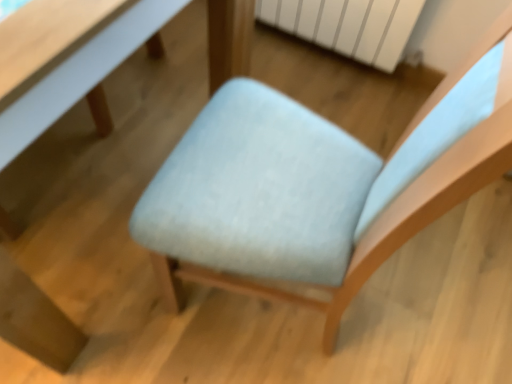
Question: From the image's perspective, is white matte radiator at upper center under light blue fabric chair at center?

Choices:
 (A) no
 (B) yes

Answer: (A)

Question: Considering the relative sizes of white matte radiator at upper center and light blue fabric chair at center in the image provided, is white matte radiator at upper center taller than light blue fabric chair at center?

Choices:
 (A) yes
 (B) no

Answer: (B)

Question: Considering the relative sizes of white matte radiator at upper center and light blue fabric chair at center in the image provided, is white matte radiator at upper center wider than light blue fabric chair at center?

Choices:
 (A) no
 (B) yes

Answer: (A)

Question: Is white matte radiator at upper center placed right next to light blue fabric chair at center?

Choices:
 (A) yes
 (B) no

Answer: (B)

Question: From a real-world perspective, does white matte radiator at upper center stand above light blue fabric chair at center?

Choices:
 (A) no
 (B) yes

Answer: (A)

Question: Considering the positions of white matte radiator at upper center and light blue fabric chair at center in the image, is white matte radiator at upper center bigger or smaller than light blue fabric chair at center?

Choices:
 (A) big
 (B) small

Answer: (B)

Question: From a real-world perspective, relative to light blue fabric chair at center, is white matte radiator at upper center vertically above or below?

Choices:
 (A) below
 (B) above

Answer: (A)

Question: Would you say white matte radiator at upper center is inside or outside light blue fabric chair at center?

Choices:
 (A) outside
 (B) inside

Answer: (A)

Question: In terms of width, does white matte radiator at upper center look wider or thinner when compared to light blue fabric chair at center?

Choices:
 (A) thin
 (B) wide

Answer: (A)

Question: In terms of width, does white glossy table at upper left, acting as the 2th table starting from the left, look wider or thinner when compared to light blue fabric chair at center?

Choices:
 (A) thin
 (B) wide

Answer: (A)

Question: Looking at the image, does white glossy table at upper left, the first table in the right-to-left sequence, seem bigger or smaller compared to light blue fabric chair at center?

Choices:
 (A) small
 (B) big

Answer: (A)

Question: From a real-world perspective, is white glossy table at upper left, acting as the 2th table starting from the left, positioned above or below light blue fabric chair at center?

Choices:
 (A) above
 (B) below

Answer: (B)

Question: Considering the relative positions of white glossy table at upper left, the first table in the right-to-left sequence, and light blue fabric chair at center in the image provided, is white glossy table at upper left, the first table in the right-to-left sequence, to the left or to the right of light blue fabric chair at center?

Choices:
 (A) right
 (B) left

Answer: (B)

Question: In the image, is white matte radiator at upper center on the left side or the right side of white glossy table at upper left, acting as the 2th table starting from the left?

Choices:
 (A) right
 (B) left

Answer: (A)

Question: Relative to white glossy table at upper left, acting as the 2th table starting from the left, is white matte radiator at upper center in front or behind?

Choices:
 (A) front
 (B) behind

Answer: (B)